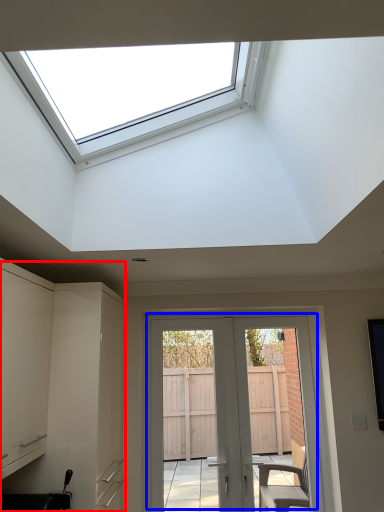
Question: Among these objects, which one is farthest to the camera, cabinetry (highlighted by a red box) or door (highlighted by a blue box)?

Choices:
 (A) cabinetry
 (B) door

Answer: (B)